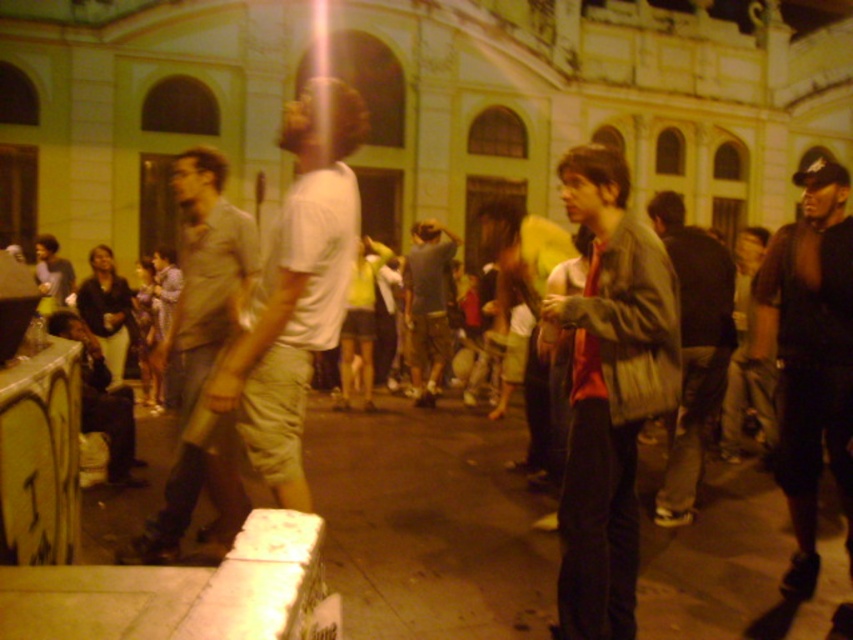
Question: Can you confirm if white cotton t-shirt at center is positioned to the left of dark gray jeans at center?

Choices:
 (A) no
 (B) yes

Answer: (B)

Question: Is matte brown jacket at center thinner than white cotton t-shirt at center?

Choices:
 (A) no
 (B) yes

Answer: (B)

Question: Among these objects, which one is farthest from the camera?

Choices:
 (A) matte brown jacket at center
 (B) white cotton t-shirt at center
 (C) light brown fabric shirt at center
 (D) matte gray jacket at center

Answer: (B)

Question: Is matte brown jacket at center to the right of gray cotton t-shirt at center from the viewer's perspective?

Choices:
 (A) no
 (B) yes

Answer: (B)

Question: Which point appears closest to the camera in this image?

Choices:
 (A) (206, 417)
 (B) (434, 323)
 (C) (767, 236)

Answer: (A)

Question: Which object is the closest to the black leather jacket at right?

Choices:
 (A) white cotton t-shirt at center
 (B) matte brown jacket at center
 (C) light brown fabric shirt at center
 (D) matte gray jacket at center

Answer: (D)